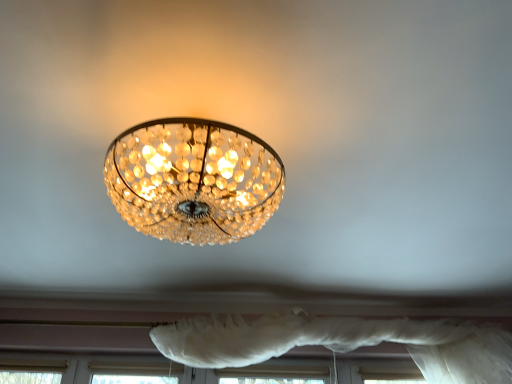
Question: Is the position of translucent crystal chandelier at upper center more distant than that of white sheer curtain at lower center?

Choices:
 (A) yes
 (B) no

Answer: (B)

Question: Is translucent crystal chandelier at upper center to the left of white sheer curtain at lower center from the viewer's perspective?

Choices:
 (A) yes
 (B) no

Answer: (A)

Question: Can you confirm if translucent crystal chandelier at upper center is shorter than white sheer curtain at lower center?

Choices:
 (A) yes
 (B) no

Answer: (A)

Question: Are translucent crystal chandelier at upper center and white sheer curtain at lower center far apart?

Choices:
 (A) no
 (B) yes

Answer: (B)

Question: Is translucent crystal chandelier at upper center bigger than white sheer curtain at lower center?

Choices:
 (A) no
 (B) yes

Answer: (A)

Question: From the image's perspective, is translucent crystal chandelier at upper center on white sheer curtain at lower center?

Choices:
 (A) no
 (B) yes

Answer: (B)

Question: Is translucent crystal chandelier at upper center surrounded by white sheer curtain at lower center?

Choices:
 (A) no
 (B) yes

Answer: (A)

Question: From a real-world perspective, is white sheer curtain at lower center over translucent crystal chandelier at upper center?

Choices:
 (A) no
 (B) yes

Answer: (A)

Question: Is white sheer curtain at lower center touching translucent crystal chandelier at upper center?

Choices:
 (A) no
 (B) yes

Answer: (A)

Question: Does white sheer curtain at lower center come behind translucent crystal chandelier at upper center?

Choices:
 (A) no
 (B) yes

Answer: (B)

Question: Can you confirm if white sheer curtain at lower center is shorter than translucent crystal chandelier at upper center?

Choices:
 (A) yes
 (B) no

Answer: (B)

Question: From the image's perspective, is white sheer curtain at lower center under translucent crystal chandelier at upper center?

Choices:
 (A) yes
 (B) no

Answer: (A)

Question: Would you say translucent crystal chandelier at upper center is to the left or to the right of white sheer curtain at lower center in the picture?

Choices:
 (A) right
 (B) left

Answer: (B)